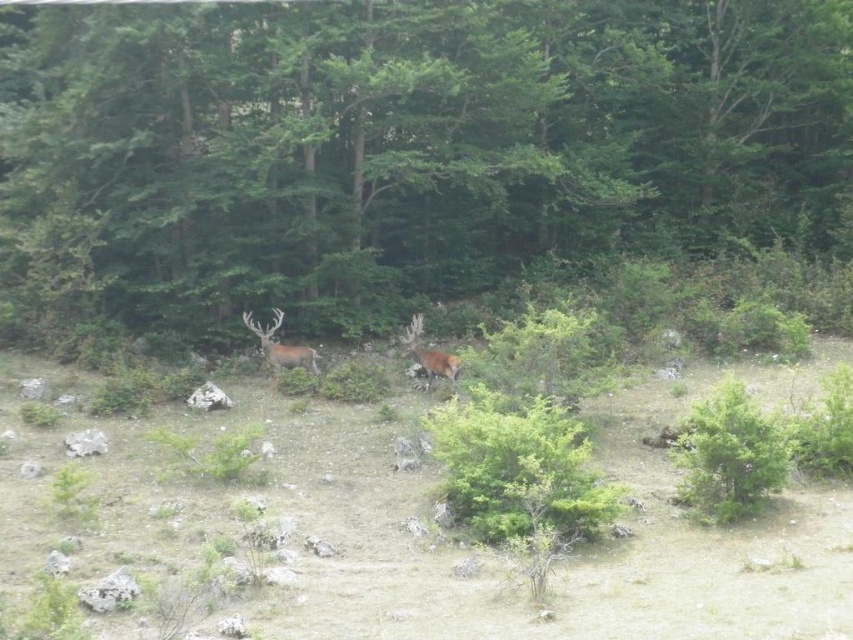
Question: Is green leafy tree at center closer to camera compared to brown velvet deer at center?

Choices:
 (A) no
 (B) yes

Answer: (B)

Question: Which of these objects is positioned farthest from the green leafy tree at center?

Choices:
 (A) brown velvet deer at center
 (B) brown furry deer at center

Answer: (B)

Question: Which object appears closest to the camera in this image?

Choices:
 (A) brown furry deer at center
 (B) green leafy tree at center

Answer: (A)

Question: Which object appears closest to the camera in this image?

Choices:
 (A) green leafy tree at center
 (B) brown velvet deer at center
 (C) brown furry deer at center

Answer: (C)

Question: Does green leafy tree at center appear on the right side of brown velvet deer at center?

Choices:
 (A) yes
 (B) no

Answer: (A)

Question: Is the position of green leafy tree at center less distant than that of brown furry deer at center?

Choices:
 (A) yes
 (B) no

Answer: (B)